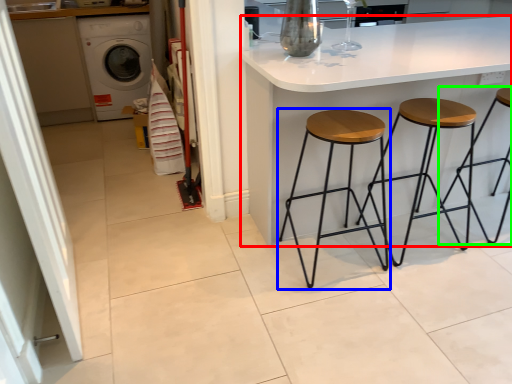
Question: Which is farther away from table (highlighted by a red box)? stool (highlighted by a blue box) or stool (highlighted by a green box)?

Choices:
 (A) stool
 (B) stool

Answer: (B)